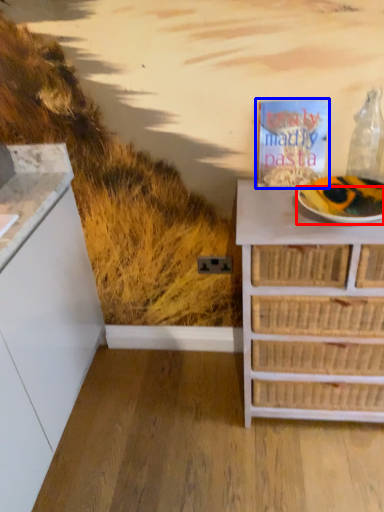
Question: Which object appears closest to the camera in this image, paper plate (highlighted by a red box) or magazine (highlighted by a blue box)?

Choices:
 (A) paper plate
 (B) magazine

Answer: (A)